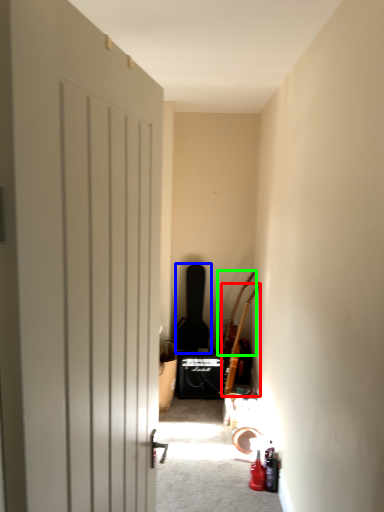
Question: Which object is positioned closest to guitar (highlighted by a red box)? Select from guitar (highlighted by a blue box) and guitar (highlighted by a green box).

Choices:
 (A) guitar
 (B) guitar

Answer: (B)